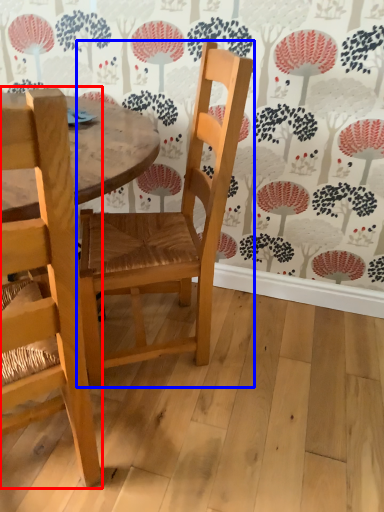
Question: Which of the following is the closest to the observer, chair (highlighted by a red box) or chair (highlighted by a blue box)?

Choices:
 (A) chair
 (B) chair

Answer: (A)